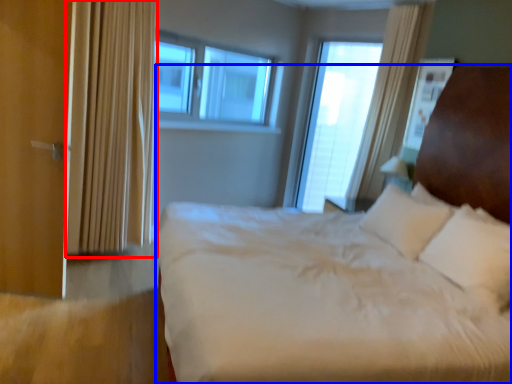
Question: Which object is closer to the camera taking this photo, curtain (highlighted by a red box) or bed (highlighted by a blue box)?

Choices:
 (A) curtain
 (B) bed

Answer: (B)